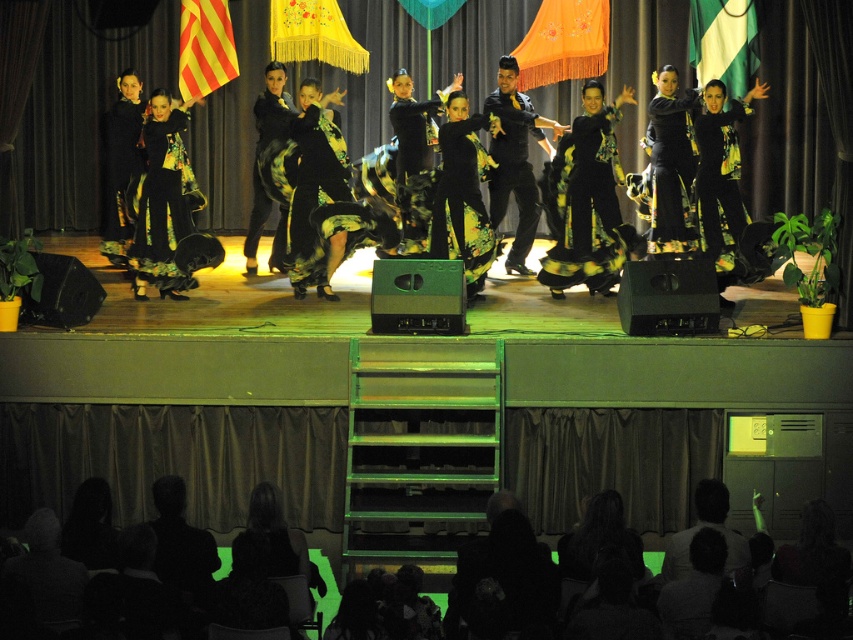
You are a photographer at the back of the stage and want to capture both the black satin dress at center and the black matte suit at center in a single photo. Which one will appear smaller in the photo?

The black satin dress at center will appear smaller in the photo because it has a smaller size compared to the black matte suit at center.

Based on the coordinates provided, which object is located at point (462,192) in the scene?

The point (462,192) indicates the black floral dress at center.

You are a photographer at the back of the stage. You want to capture a clear photo of the black floral dress at center without the black satin dress at center blocking it. Is this possible?

The black satin dress at center is positioned over the black floral dress at center, so it is blocking the view. Therefore, it is not possible to capture a clear photo of the black floral dress at center without the black satin dress at center blocking it.